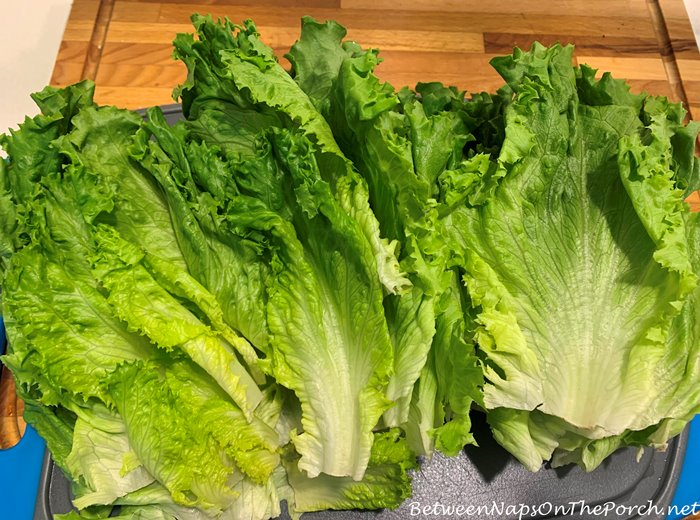
Find the location of a particular element. finished wood is located at coordinates (402, 39).